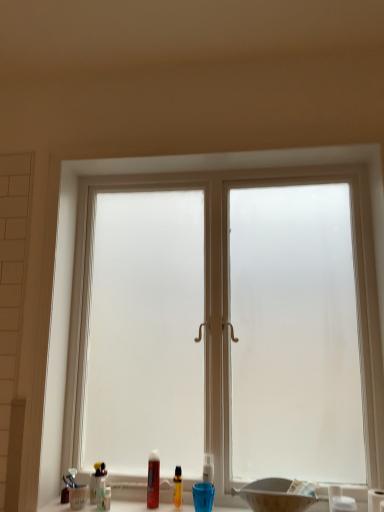
Question: Relative to translucent plastic bottles at lower center, is white plastic toothbrush at lower center, which is counted as the fourth toiletry, starting from the left, in front or behind?

Choices:
 (A) front
 (B) behind

Answer: (B)

Question: Would you say white plastic toothbrush at lower center, which is the 1th toiletry from front to back, is to the left or to the right of translucent plastic bottles at lower center in the picture?

Choices:
 (A) right
 (B) left

Answer: (A)

Question: Considering the real-world distances, which object is farthest from the translucent plastic bottle at center, the 1th toiletry when ordered from back to front?

Choices:
 (A) matte black basin at lower center
 (B) white matte toilet paper at right
 (C) translucent plastic bottles at lower center
 (D) frosted glass window at center
 (E) translucent plastic bottle at lower center, positioned as the second toiletry in back-to-front order

Answer: (B)

Question: Considering the real-world distances, which object is closest to the matte black basin at lower center?

Choices:
 (A) translucent plastic bottle at lower center, placed as the 3th toiletry when sorted from front to back
 (B) white matte toilet paper at right
 (C) translucent plastic bottles at lower center
 (D) translucent plastic bottle at center, the 1th toiletry when ordered from back to front
 (E) frosted glass window at center

Answer: (C)